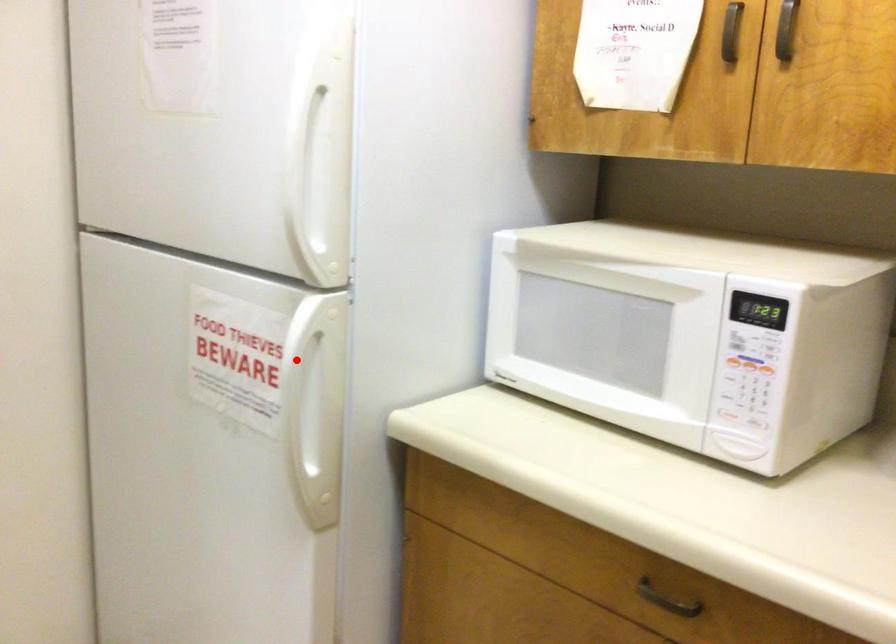
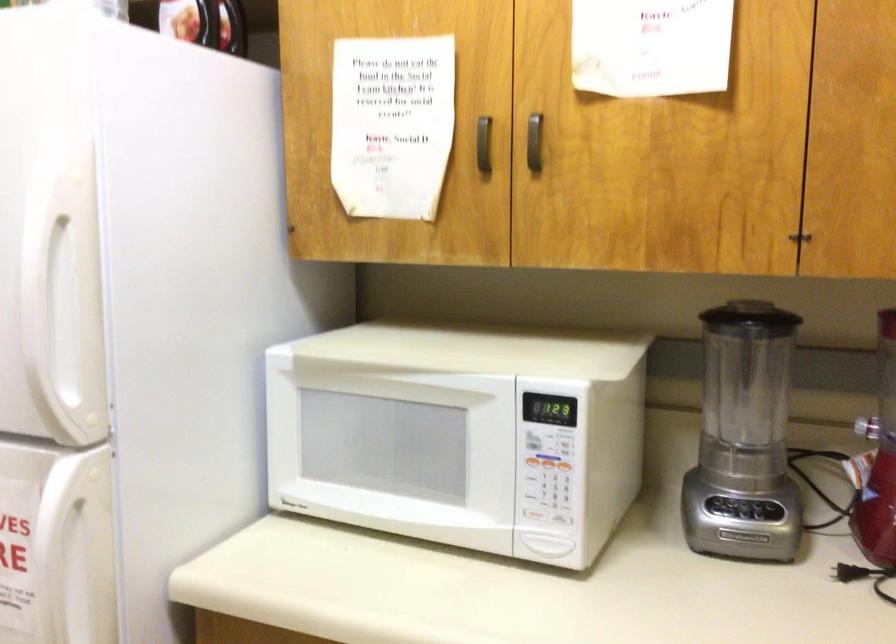
Question: I am providing you with two images of the same scene from different viewpoints. In image1, a red point is highlighted. Considering the same 3D point in image2, which of the following is correct?

Choices:
 (A) It is closer
 (B) It is farther

Answer: (A)